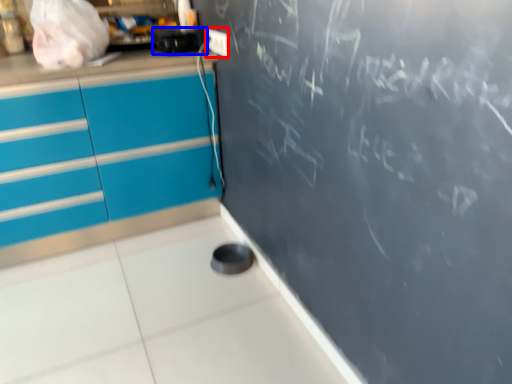
Question: Which object is closer to the camera taking this photo, electric outlet (highlighted by a red box) or appliance (highlighted by a blue box)?

Choices:
 (A) electric outlet
 (B) appliance

Answer: (B)